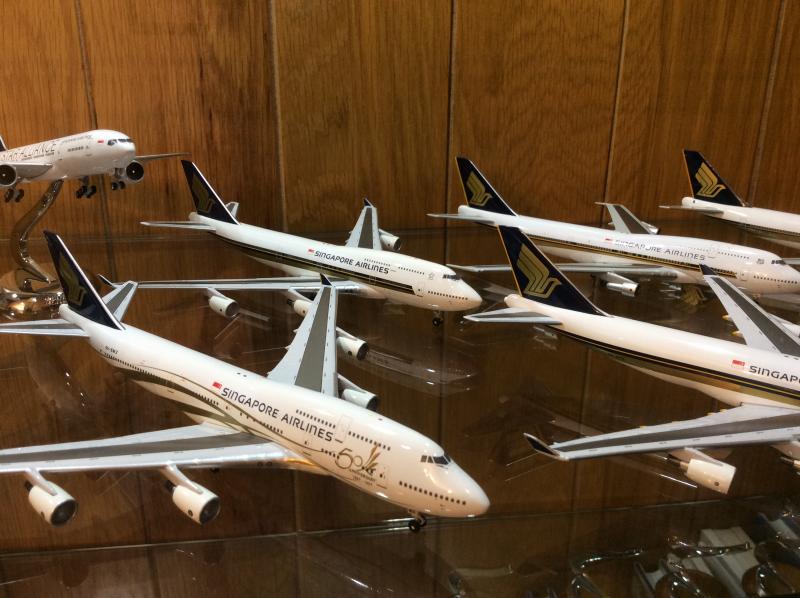
Image resolution: width=800 pixels, height=598 pixels. I want to click on wooden panel, so click(332, 106).